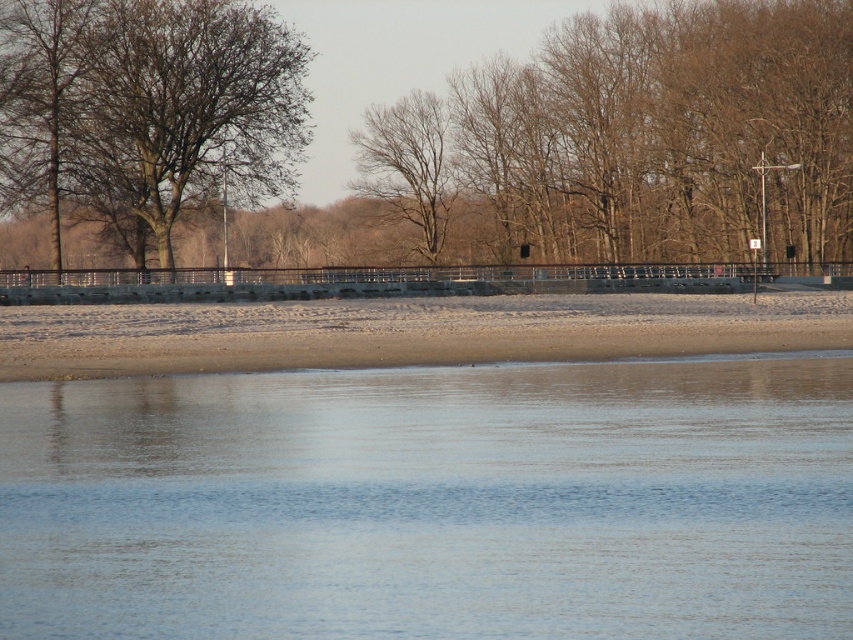
You are standing on the beach and want to cross to the other side. You see the clear water at lower center and the bare branches at left. Which one is wider so you can walk across it more easily?

The clear water at lower center might be wider than the bare branches at left, so you can walk across the clear water at lower center more easily.

You are standing on the beach and want to walk towards the water. Which object, the bare branches at left or the bare wood tree at center, will you pass first?

The bare branches at left will be passed first since they are in front of the bare wood tree at center, meaning they are closer to your current position on the beach.